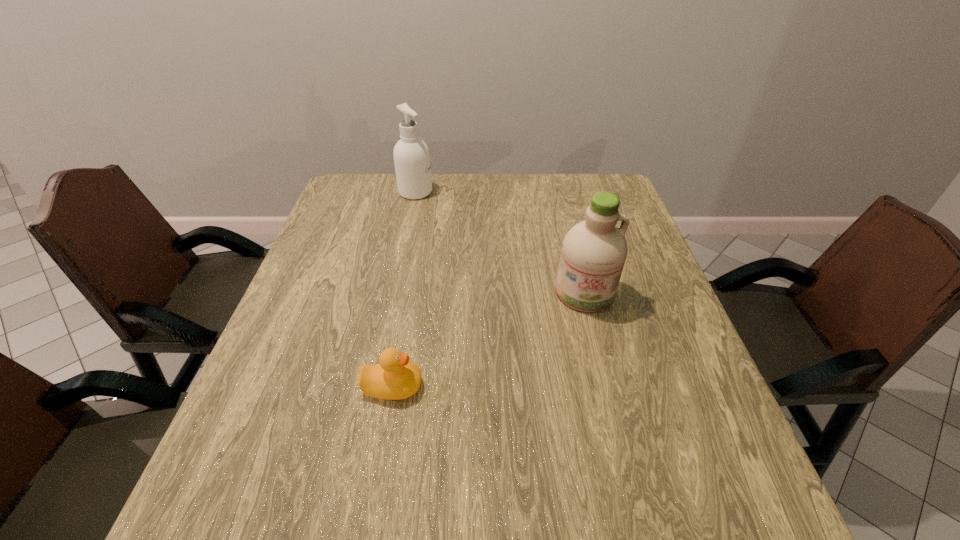
I want to click on the left cleansing agent, so click(x=411, y=155).

Find the location of a particular element. The height and width of the screenshot is (540, 960). the farther cleansing agent is located at coordinates (411, 155).

Identify the location of the nearer cleansing agent. The height and width of the screenshot is (540, 960). (594, 251).

Find the location of a particular element. The height and width of the screenshot is (540, 960). the rightmost object is located at coordinates (594, 251).

In order to click on the nearest object in this screenshot , I will do `click(395, 377)`.

At what (x,y) coordinates should I click in order to perform the action: click on duck. Please return your answer as a coordinate pair (x, y). This screenshot has width=960, height=540. Looking at the image, I should click on (395, 377).

Where is `blank space located 0.330m on the front label of the left cleansing agent`? blank space located 0.330m on the front label of the left cleansing agent is located at coordinates (536, 192).

Locate an element on the screen. The height and width of the screenshot is (540, 960). blank space located 0.090m on the front label of the second nearest object is located at coordinates (597, 345).

Where is `vacant area situated 0.220m on the face of the nearest object`? This screenshot has height=540, width=960. vacant area situated 0.220m on the face of the nearest object is located at coordinates (534, 386).

Where is `object that is at the far edge`? Image resolution: width=960 pixels, height=540 pixels. object that is at the far edge is located at coordinates (411, 155).